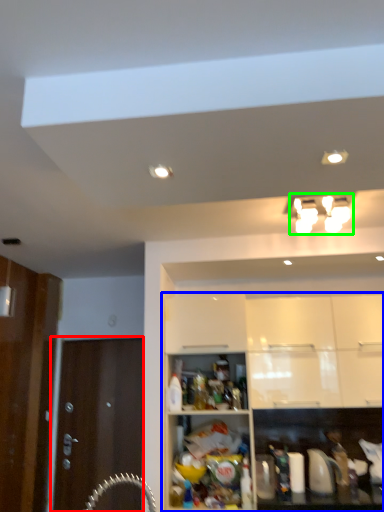
Question: Which object is the farthest from door (highlighted by a red box)? Choose among these: cabinetry (highlighted by a blue box) or light fixture (highlighted by a green box).

Choices:
 (A) cabinetry
 (B) light fixture

Answer: (B)